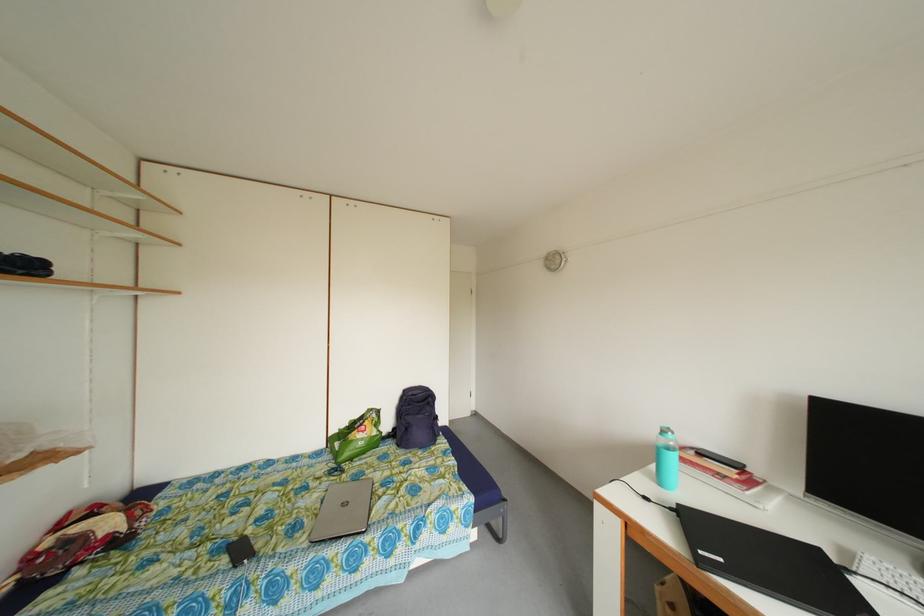
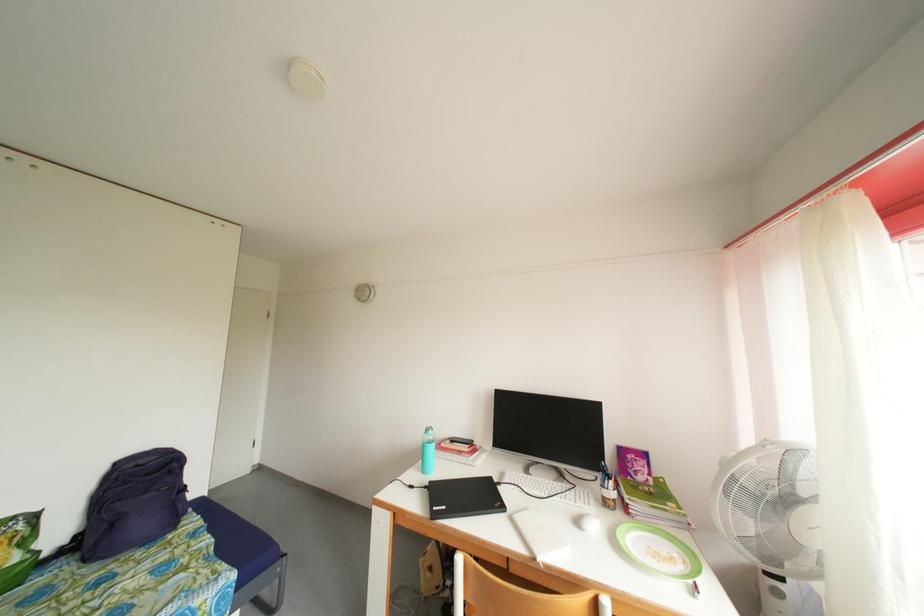
The point at [678,515] is marked in the first image. Where is the corresponding point in the second image?

(432, 493)